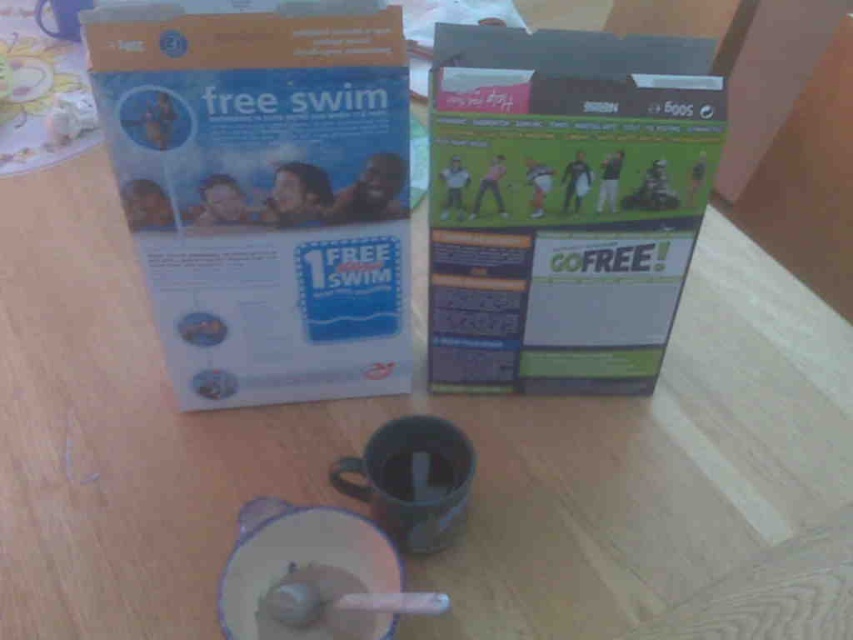
You are organizing a community event and have these two boxes, the matte white cardboard box at upper left and the matte green cardboard box at center. If you need to place them side by side on a shelf that can only accommodate the wider one, which box should you prioritize placing first?

The matte green cardboard box at center is wider than the matte white cardboard box at upper left, so you should prioritize placing the matte green cardboard box at center first to ensure it fits on the shelf.

You are a photographer who needs to capture a clear image of the matte white cardboard box at upper left. Your camera is currently positioned 18.64 inches away from the box. Is the distance sufficient to ensure the box is in focus?

The matte white cardboard box at upper left and camera are 18.64 inches apart, so the distance is sufficient to ensure the box is in focus.